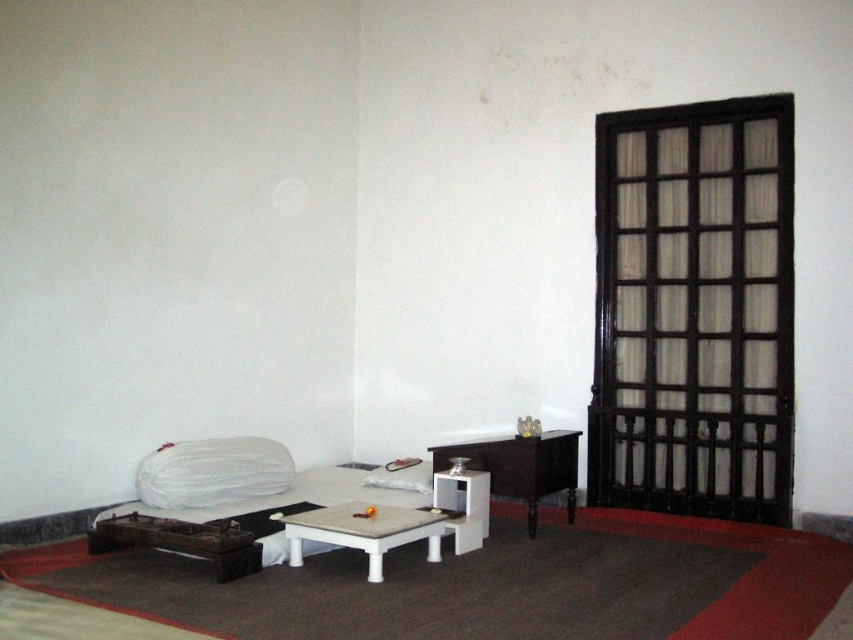
Question: Which of the following is the closest to the observer?

Choices:
 (A) (395, 486)
 (B) (256, 472)

Answer: (B)

Question: Is the position of white fabric pillow at lower center more distant than that of white glossy table at center?

Choices:
 (A) yes
 (B) no

Answer: (A)

Question: Is white fabric pillow at lower center bigger than matte black table at center?

Choices:
 (A) no
 (B) yes

Answer: (A)

Question: Estimate the real-world distances between objects in this image. Which object is closer to the white fabric pillow at lower center?

Choices:
 (A) white glossy table at center
 (B) white fabric bed at lower left

Answer: (B)

Question: Estimate the real-world distances between objects in this image. Which object is farther from the white fabric bed at lower left?

Choices:
 (A) white fabric pillow at lower center
 (B) matte black table at center
 (C) white glossy table at center

Answer: (B)

Question: Can you confirm if white fabric bed at lower left is smaller than white glossy table at center?

Choices:
 (A) no
 (B) yes

Answer: (A)